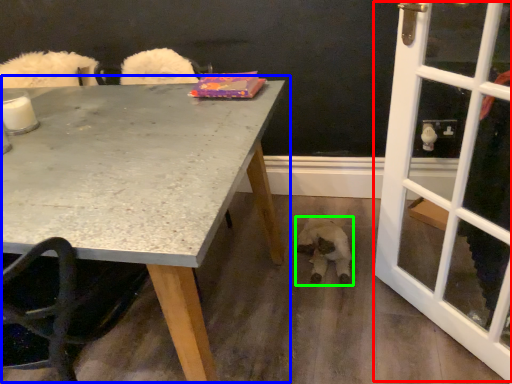
Question: Which is nearer to the screen door (highlighted by a red box)? table (highlighted by a blue box) or animal (highlighted by a green box).

Choices:
 (A) table
 (B) animal

Answer: (B)